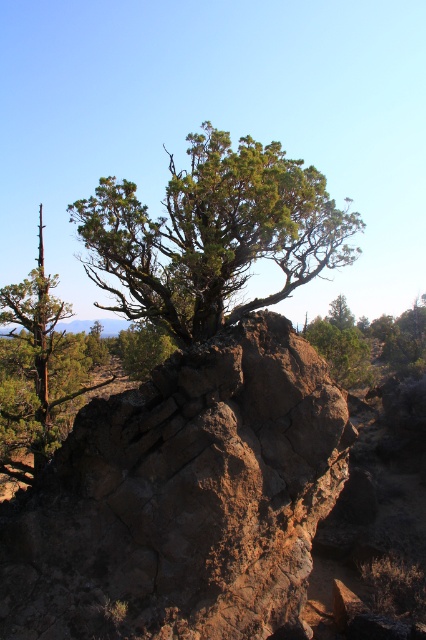
You are standing at a viewpoint 30 feet away from the brown rough rock at center. Can you safely walk towards it without exceeding the 30 feet distance limit set by the park ranger?

The brown rough rock at center is 31.89 feet away from the camera, which exceeds the 30 feet distance limit set by the park ranger. Therefore, walking towards it would surpass the allowed distance.

You are a hiker standing at the base of the large rock formation. You notice two trees at the center of the image. Which tree, the green leafy tree at center or the green rough textured tree at center, is positioned closer to you?

The green leafy tree at center is closer to the viewer than the green rough textured tree at center.

You are a hiker trying to identify two trees in the center of the landscape. You notice both are labeled as green leafy tree at center and green rough textured tree at center. Which of these two trees is smaller in size?

The green leafy tree at center is smaller in size compared to the green rough textured tree at center.